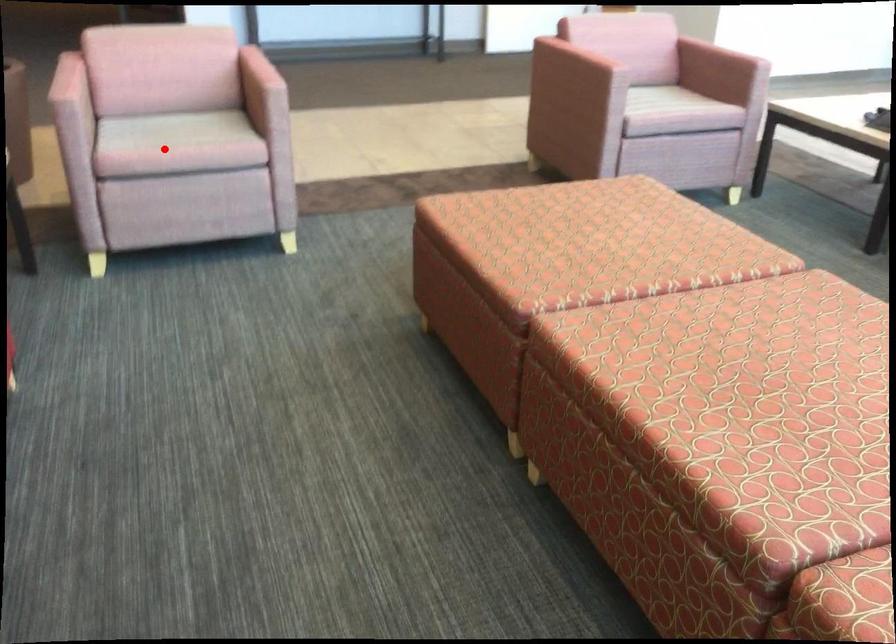
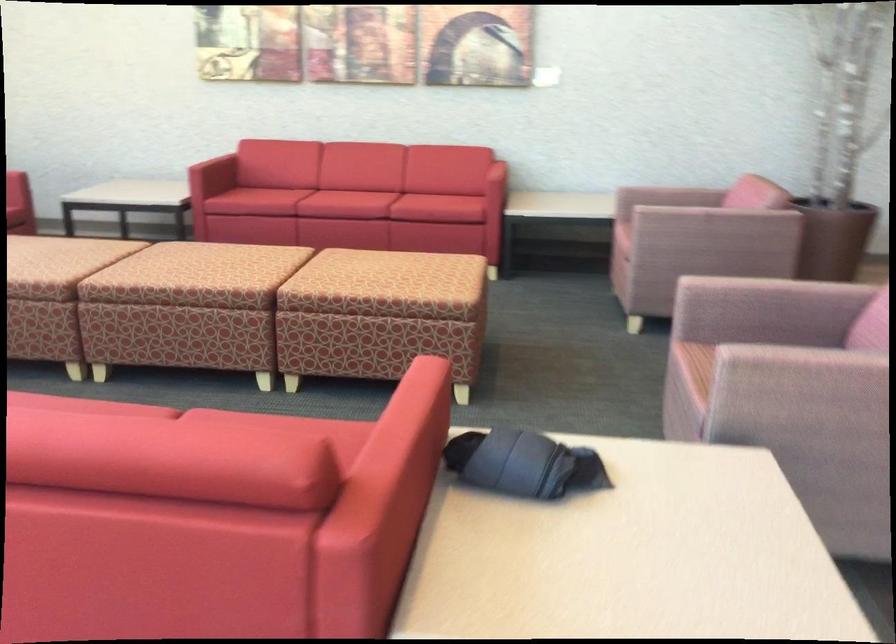
Find the pixel in the second image that matches the highlighted location in the first image.

(624, 218)